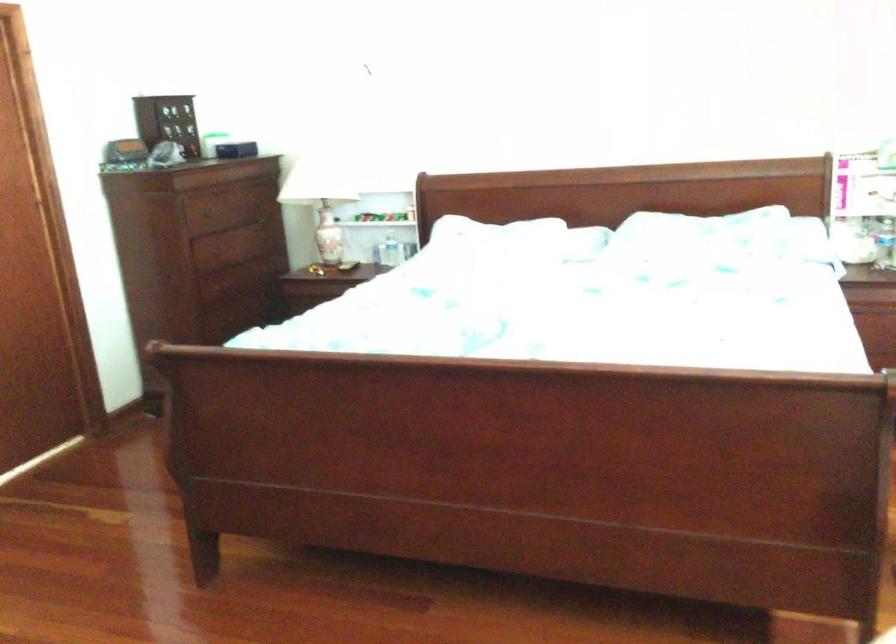
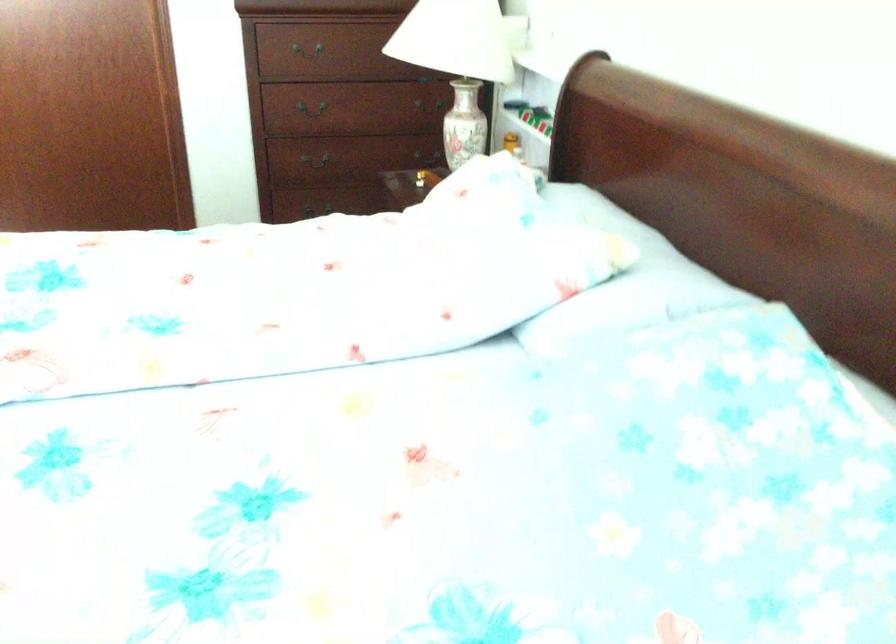
Locate, in the second image, the point that corresponds to [242,307] in the first image.

(323, 158)